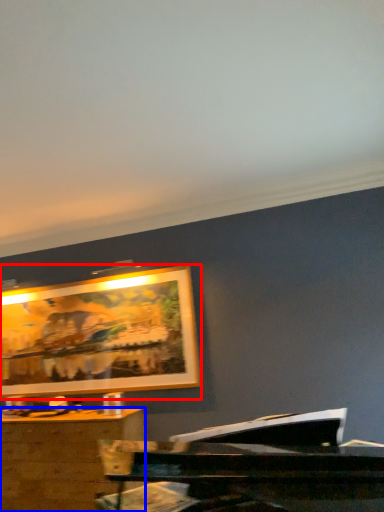
Question: Among these objects, which one is farthest to the camera, picture frame (highlighted by a red box) or desk (highlighted by a blue box)?

Choices:
 (A) picture frame
 (B) desk

Answer: (A)